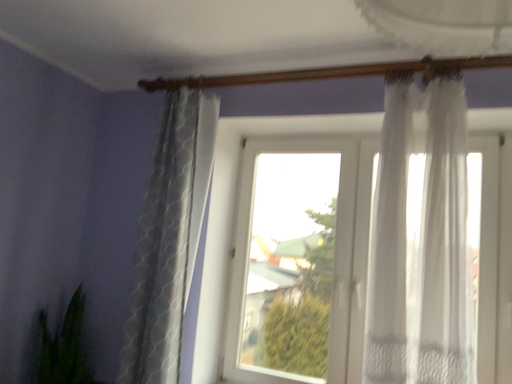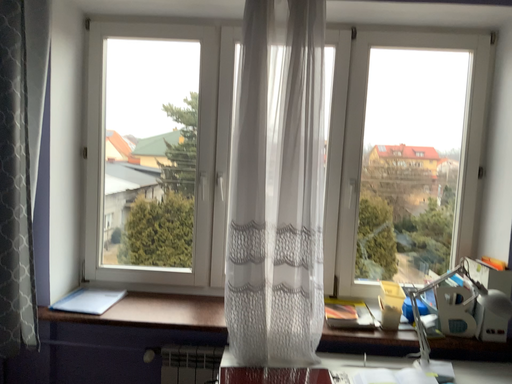
Question: Which way did the camera rotate in the video?

Choices:
 (A) rotated downward
 (B) rotated upward

Answer: (A)